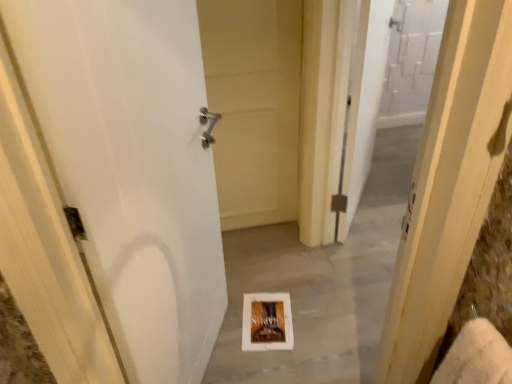
Identify the location of vacant space positioned to the left of white cardboard book at center. (226, 324).